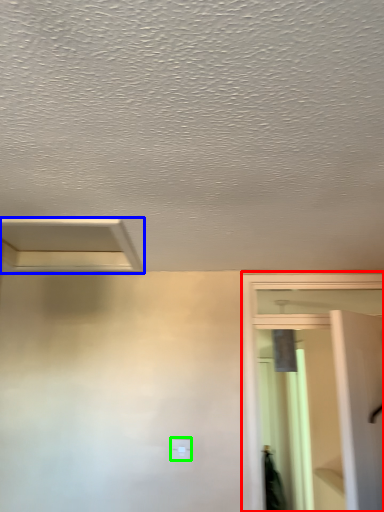
Question: Based on their relative distances, which object is nearer to screen door (highlighted by a red box)? Choose from exhaust hood (highlighted by a blue box) and light switch (highlighted by a green box).

Choices:
 (A) exhaust hood
 (B) light switch

Answer: (B)